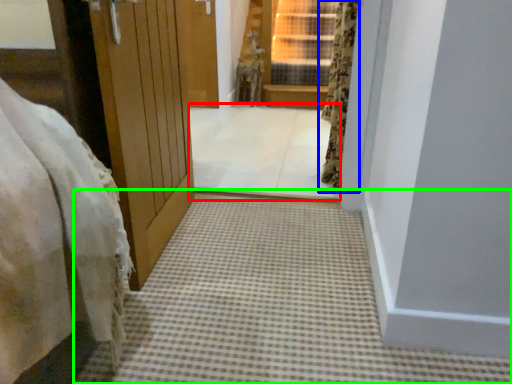
Question: Estimate the real-world distances between objects in this image. Which object is closer to passage (highlighted by a red box), curtain (highlighted by a blue box) or path (highlighted by a green box)?

Choices:
 (A) curtain
 (B) path

Answer: (A)